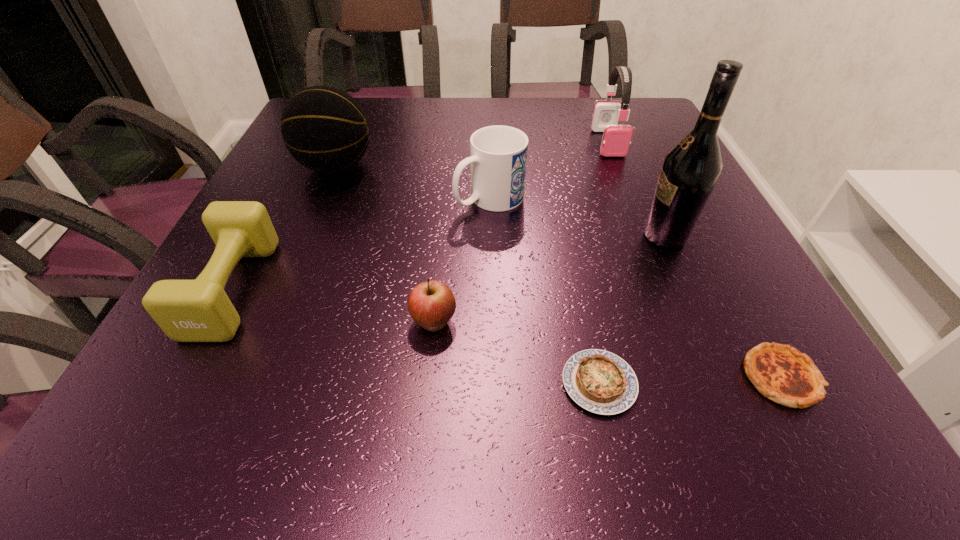
Locate an element on the screen. The width and height of the screenshot is (960, 540). vacant space situated on the label of the wine bottle is located at coordinates (487, 236).

Locate an element on the screen. blank space located on the label of the wine bottle is located at coordinates (574, 236).

This screenshot has height=540, width=960. Find the location of `free location located on the right of the basketball`. free location located on the right of the basketball is located at coordinates (521, 167).

Identify the location of free spot located on the outer surface of the earphone. (636, 212).

The width and height of the screenshot is (960, 540). In order to click on vacant space positioned on the right of the fourth tallest object in this screenshot , I will do `click(557, 199)`.

Where is `vacant space situated 0.240m on the back of the dumbbell`? The width and height of the screenshot is (960, 540). vacant space situated 0.240m on the back of the dumbbell is located at coordinates (293, 173).

The image size is (960, 540). I want to click on free space located on the left of the apple, so click(262, 323).

Identify the location of vacant space located 0.310m on the back of the right quiche. This screenshot has width=960, height=540. coord(696,221).

Where is `vacant space situated on the left of the fifth object from left to right`? This screenshot has width=960, height=540. vacant space situated on the left of the fifth object from left to right is located at coordinates (409, 383).

The width and height of the screenshot is (960, 540). Identify the location of object that is at the far edge. (616, 138).